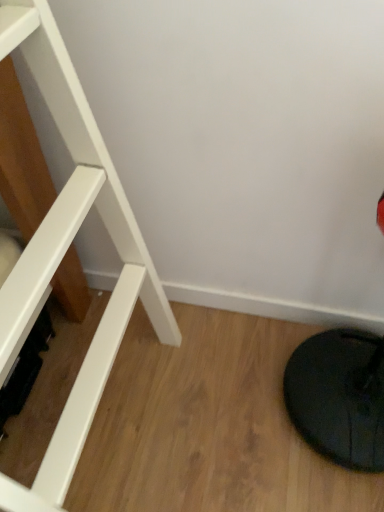
In order to face black leather swivel chair at lower right, should I rotate leftwards or rightwards?

To face it directly, rotate right by 23.805 degrees.

The image size is (384, 512). I want to click on black leather swivel chair at lower right, so click(x=339, y=396).

Describe the element at coordinates (339, 396) in the screenshot. I see `black leather swivel chair at lower right` at that location.

Find the location of a particular element. The image size is (384, 512). black leather swivel chair at lower right is located at coordinates (339, 396).